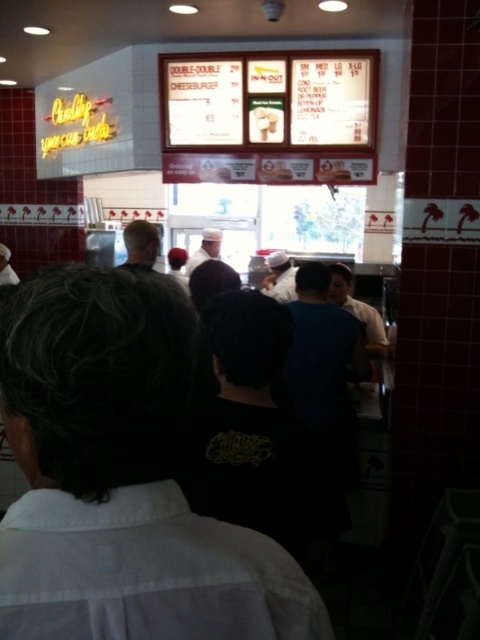
Question: Which of the following is the farthest from the observer?

Choices:
 (A) (220, 492)
 (B) (131, 620)

Answer: (A)

Question: Does black shirt at center appear on the left side of black fabric shirt at center?

Choices:
 (A) yes
 (B) no

Answer: (A)

Question: Is black shirt at center above black fabric shirt at center?

Choices:
 (A) no
 (B) yes

Answer: (B)

Question: Which point appears closest to the camera in this image?

Choices:
 (A) (320, 627)
 (B) (273, 468)

Answer: (A)

Question: In this image, where is black shirt at center located relative to black fabric shirt at center?

Choices:
 (A) above
 (B) below

Answer: (A)